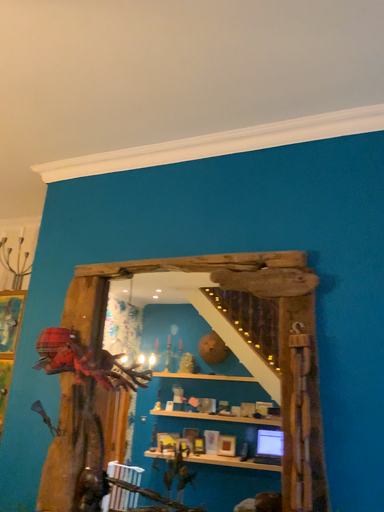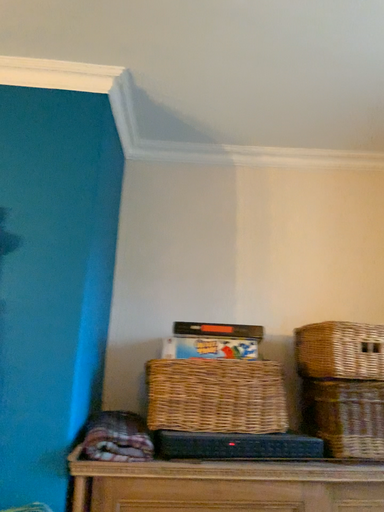
Question: How did the camera likely rotate when shooting the video?

Choices:
 (A) rotated left
 (B) rotated right

Answer: (B)